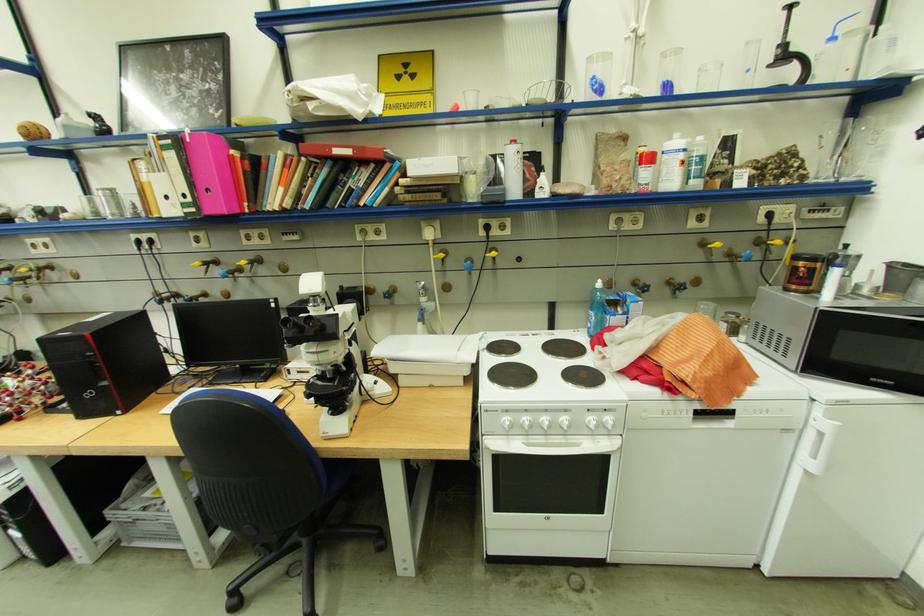
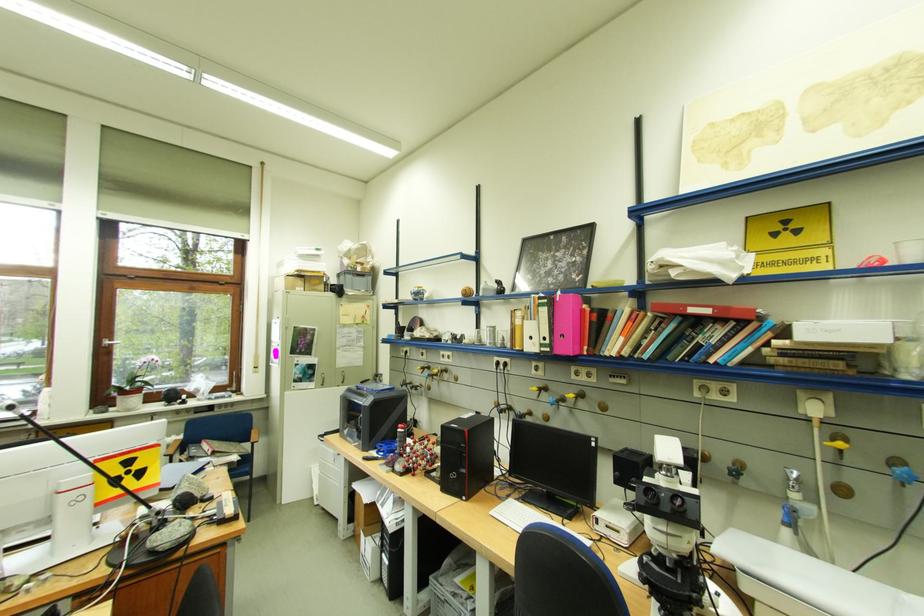
Locate, in the second image, the point that corresponds to point 428,284 in the first image.

(798, 471)